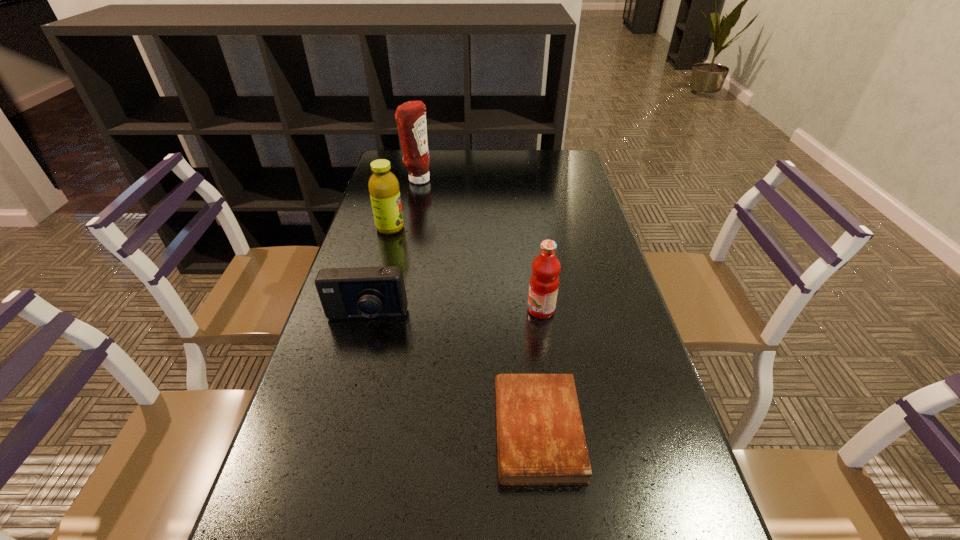
Where is `object identified as the closest to the condiment`? This screenshot has height=540, width=960. object identified as the closest to the condiment is located at coordinates (383, 185).

Identify the location of object identified as the second closest to the right fruit juice. (364, 292).